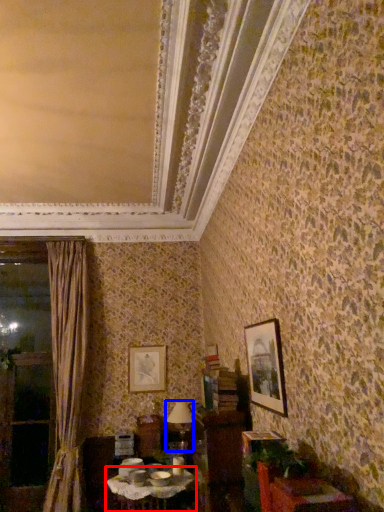
Question: Which object appears farthest to the camera in this image, table (highlighted by a red box) or table lamp (highlighted by a blue box)?

Choices:
 (A) table
 (B) table lamp

Answer: (B)